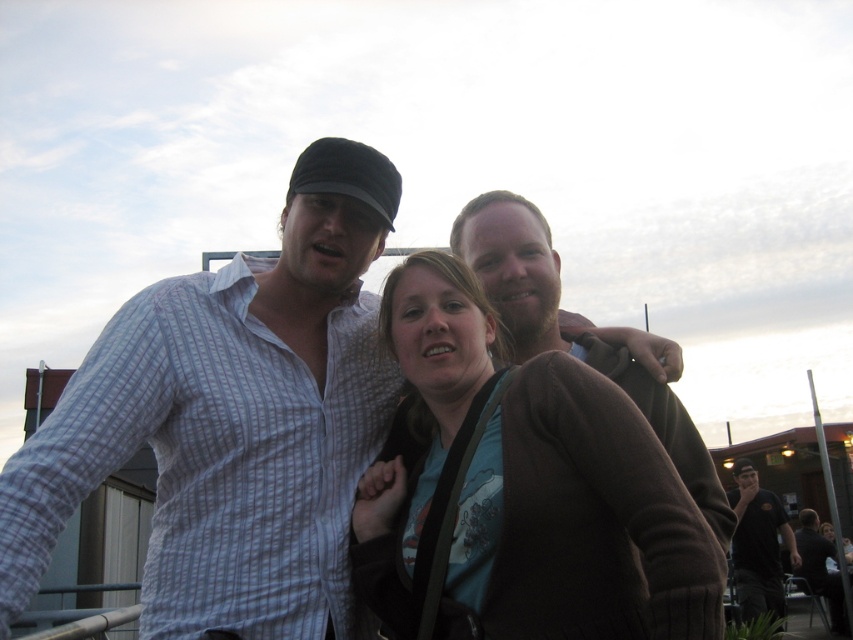
Question: Is brown soft sweater at center behind black cotton shirt at lower right?

Choices:
 (A) yes
 (B) no

Answer: (B)

Question: Does brown soft sweater at center appear over black cotton shirt at lower right?

Choices:
 (A) yes
 (B) no

Answer: (A)

Question: Does brown soft sweater at center have a larger size compared to black cotton shirt at lower right?

Choices:
 (A) yes
 (B) no

Answer: (B)

Question: Which point is closer to the camera taking this photo?

Choices:
 (A) (781, 513)
 (B) (556, 397)

Answer: (B)

Question: Which of the following is the closest to the observer?

Choices:
 (A) (772, 600)
 (B) (444, 282)

Answer: (B)

Question: Which point is closer to the camera taking this photo?

Choices:
 (A) (757, 534)
 (B) (665, 456)

Answer: (B)